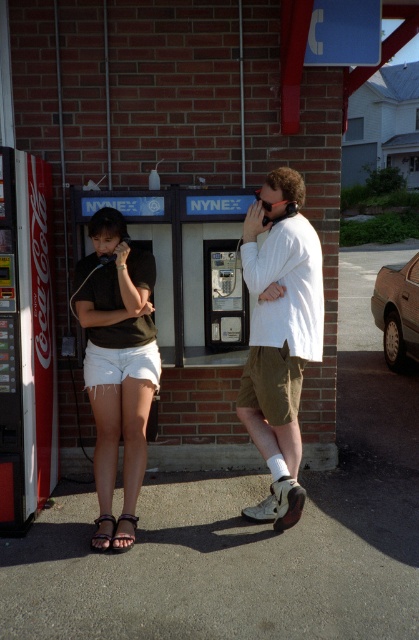
You are a photographer trying to capture a closeup of the denim shorts at left and the brown leather sandal at lower left. Which object should you zoom in on to ensure both are in focus without moving the camera?

The denim shorts at left is wider than the brown leather sandal at lower left, so you should focus on the denim shorts at left to ensure both are in focus.

You are a photographer standing at the back of the scene. You want to take a photo of the white cotton shirt at center and denim shorts at left. Which one will be closer to the camera in the photo?

The white cotton shirt at center will be closer to the camera in the photo because the denim shorts at left is behind it.

You are standing in front of the payphone booth and see two people. Which person is wearing the white cotton shirt at center and is positioned to the right of the denim shorts at left?

The man wearing the white cotton shirt at center is positioned to the right of the denim shorts at left, which the woman is wearing.